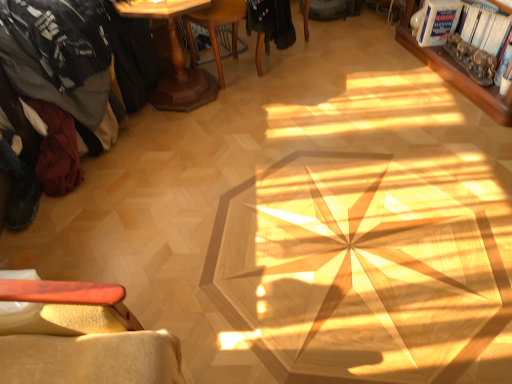
Question: Considering the relative sizes of wooden bookshelf at upper right and dark gray fabric at left in the image provided, is wooden bookshelf at upper right bigger than dark gray fabric at left?

Choices:
 (A) yes
 (B) no

Answer: (B)

Question: Considering the relative sizes of wooden bookshelf at upper right and dark gray fabric at left in the image provided, is wooden bookshelf at upper right thinner than dark gray fabric at left?

Choices:
 (A) yes
 (B) no

Answer: (A)

Question: From the image's perspective, is wooden bookshelf at upper right below dark gray fabric at left?

Choices:
 (A) no
 (B) yes

Answer: (A)

Question: Could you tell me if wooden bookshelf at upper right is turned towards dark gray fabric at left?

Choices:
 (A) yes
 (B) no

Answer: (A)

Question: From a real-world perspective, is wooden bookshelf at upper right physically above dark gray fabric at left?

Choices:
 (A) no
 (B) yes

Answer: (A)

Question: Is wooden bookshelf at upper right in contact with dark gray fabric at left?

Choices:
 (A) no
 (B) yes

Answer: (A)

Question: Is black fabric chair at center, arranged as the first chair when viewed from the right, oriented towards dark gray fabric at left?

Choices:
 (A) no
 (B) yes

Answer: (A)

Question: Is black fabric chair at center, arranged as the first chair when viewed from the right, positioned far away from dark gray fabric at left?

Choices:
 (A) no
 (B) yes

Answer: (A)

Question: Considering the relative sizes of black fabric chair at center, arranged as the first chair when viewed from the right, and dark gray fabric at left in the image provided, is black fabric chair at center, arranged as the first chair when viewed from the right, shorter than dark gray fabric at left?

Choices:
 (A) no
 (B) yes

Answer: (B)

Question: From a real-world perspective, is black fabric chair at center, arranged as the first chair when viewed from the right, located higher than dark gray fabric at left?

Choices:
 (A) yes
 (B) no

Answer: (B)

Question: Does black fabric chair at center, arranged as the first chair when viewed from the right, have a smaller size compared to dark gray fabric at left?

Choices:
 (A) no
 (B) yes

Answer: (B)

Question: Can you confirm if black fabric chair at center, positioned as the 2th chair in left-to-right order, is positioned to the right of dark gray fabric at left?

Choices:
 (A) yes
 (B) no

Answer: (A)

Question: Is metallic silver magazine at upper right, the second magazine viewed from the top, oriented towards wooden pedestal table at upper left?

Choices:
 (A) no
 (B) yes

Answer: (B)